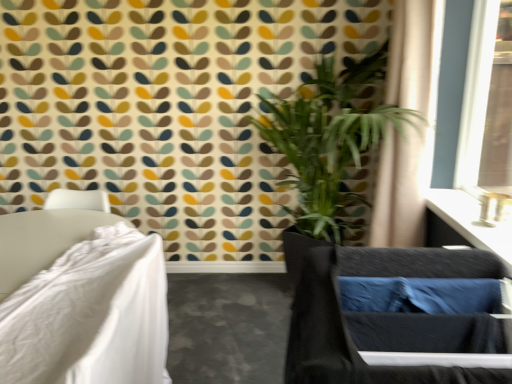
Question: Based on their positions, is beige fabric curtain at upper right located to the left or right of black fabric swivel chair at lower right?

Choices:
 (A) right
 (B) left

Answer: (A)

Question: Is point (416, 87) positioned closer to the camera than point (332, 319)?

Choices:
 (A) farther
 (B) closer

Answer: (A)

Question: Estimate the real-world distances between objects in this image. Which object is closer to the beige fabric curtain at upper right?

Choices:
 (A) white fabric bed at left
 (B) black fabric swivel chair at lower right
 (C) green leafy plant at center
 (D) satin black vanity at upper right

Answer: (C)

Question: Based on their relative distances, which object is farther from the black fabric swivel chair at lower right?

Choices:
 (A) beige fabric curtain at upper right
 (B) satin black vanity at upper right
 (C) green leafy plant at center
 (D) white fabric bed at left

Answer: (C)